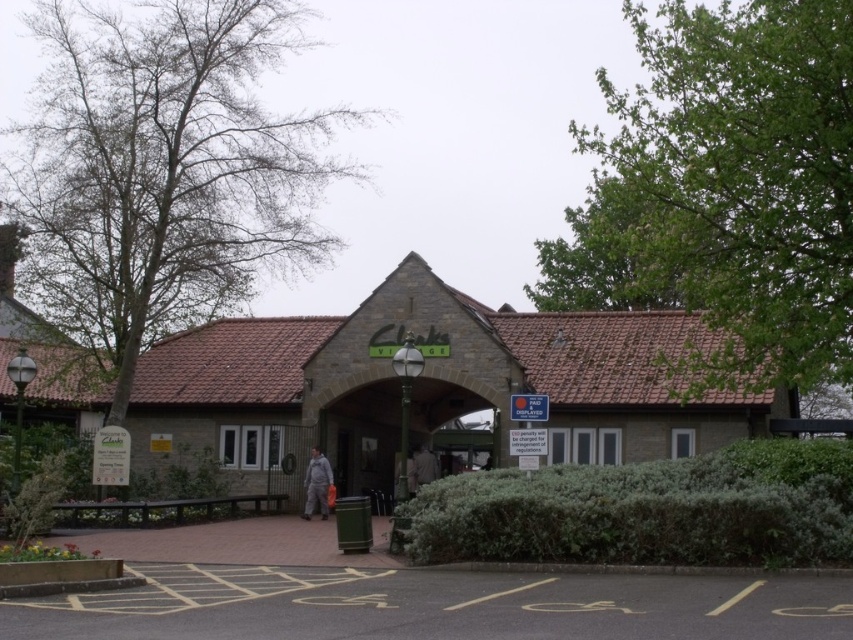
You are standing at the entrance of Clarks Village and want to take a photo that includes both the point at coordinates point [775,518] and point [428,483]. Considering their positions, which point should you focus on first to ensure both are in sharp focus?

You should focus on point [775,518] first because it is closer to the camera, ensuring both points will be in focus when using a suitable aperture.

You are standing at the entrance of Clarks Village and want to place a new bench between the green leafy hedge at lower center and the lamppost. The bench requires 2 meters of space. Is there enough space between them?

The distance between the green leafy hedge at lower center and the lamppost is 16.91 meters, so there is more than enough space to place the bench requiring 2 meters between them.

You are standing at the entrance of Clarks Village and want to sit on a bench that is behind the gray fabric jacket at center. Can you walk directly to the bench without moving around the green leafy hedge at lower center?

The green leafy hedge at lower center is closer to the viewer than the gray fabric jacket at center, so the bench behind the gray fabric jacket at center would be further back. You would need to move around the hedge to reach the bench.